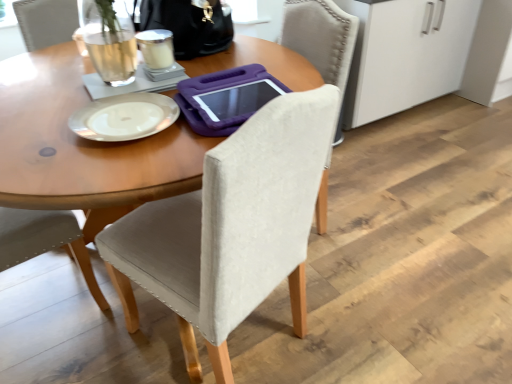
You are a GUI agent. You are given a task and a screenshot of the screen. Output one action in this format:
    pyautogui.click(x=<x>, y=<y>)
    Task: Click on the vacant space to the right of beige fabric chair at center
    The image size is (512, 384).
    Given the screenshot: What is the action you would take?
    pyautogui.click(x=364, y=312)